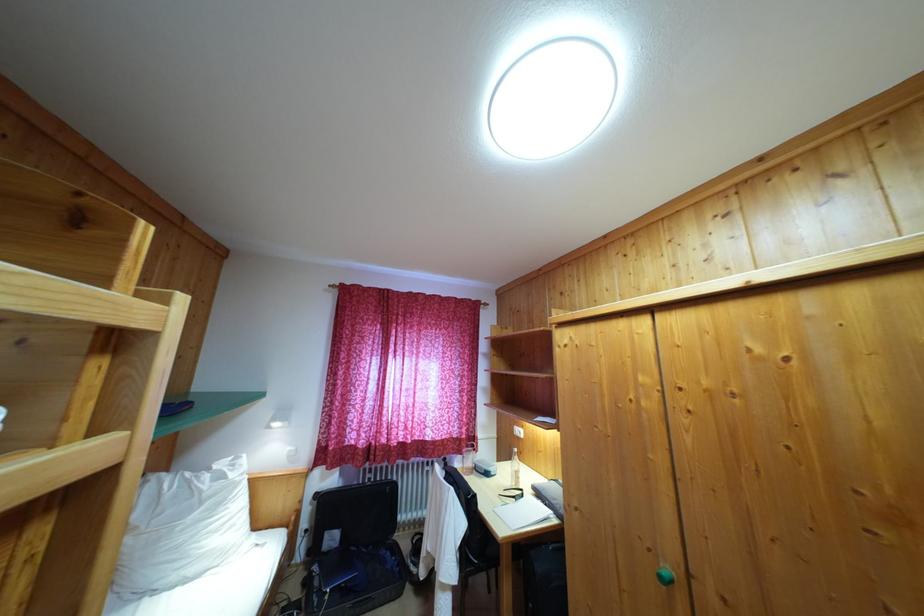
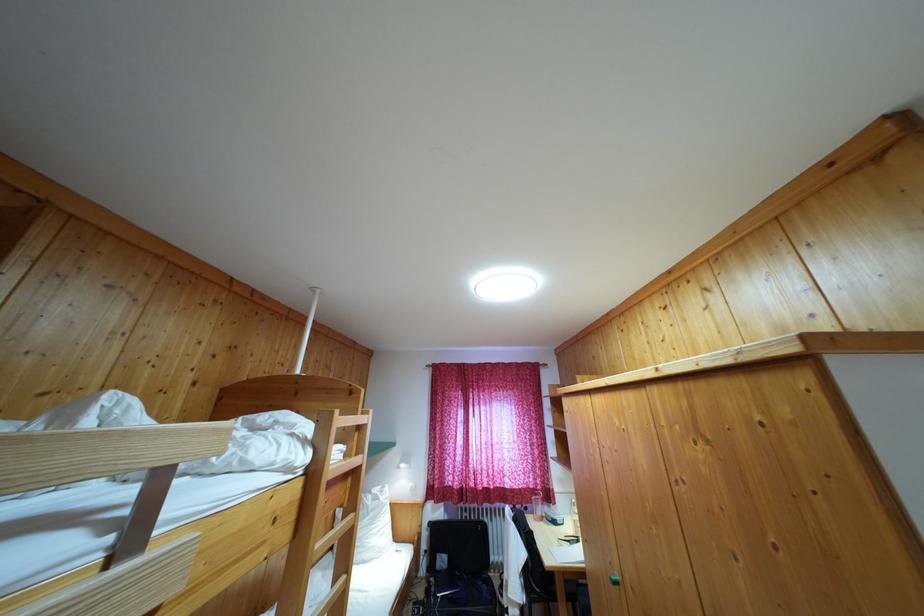
Locate, in the second image, the point that corresponds to (x=335, y=545) in the first image.

(445, 567)